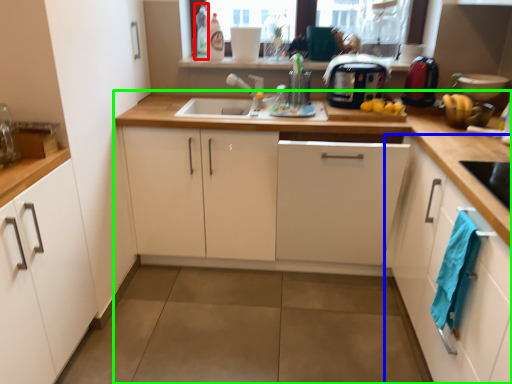
Question: Which object is positioned farthest from bottle (highlighted by a red box)? Select from cabinetry (highlighted by a blue box) and countertop (highlighted by a green box).

Choices:
 (A) cabinetry
 (B) countertop

Answer: (A)